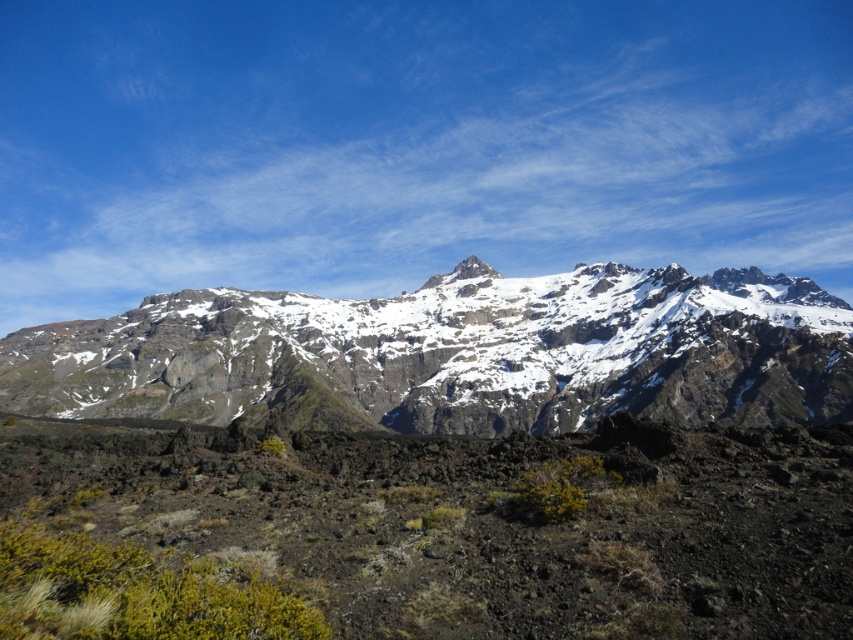
Question: Can you confirm if snowy rocky mountain range at center is positioned to the left of white rocky peak at center?

Choices:
 (A) no
 (B) yes

Answer: (A)

Question: Is snowy rocky mountain range at center thinner than white rocky peak at center?

Choices:
 (A) yes
 (B) no

Answer: (B)

Question: Can you confirm if snowy rocky mountain range at center is smaller than white rocky peak at center?

Choices:
 (A) no
 (B) yes

Answer: (A)

Question: Which point appears closest to the camera in this image?

Choices:
 (A) (561, 406)
 (B) (482, 262)

Answer: (A)